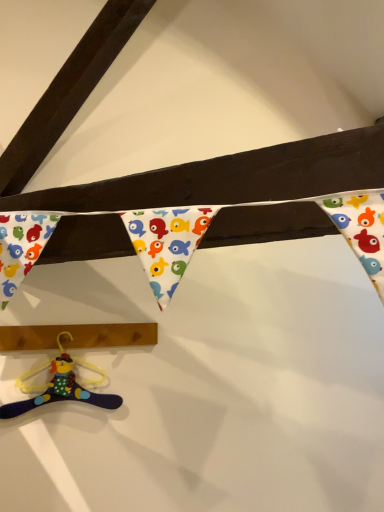
Locate an element on the screen. Image resolution: width=384 pixels, height=512 pixels. velvety purple hanger at lower left is located at coordinates (61, 384).

The width and height of the screenshot is (384, 512). What do you see at coordinates (61, 384) in the screenshot? I see `velvety purple hanger at lower left` at bounding box center [61, 384].

This screenshot has height=512, width=384. Describe the element at coordinates (77, 336) in the screenshot. I see `wooden plank at lower left` at that location.

At what (x,y) coordinates should I click in order to perform the action: click on wooden plank at lower left. Please return your answer as a coordinate pair (x, y). Looking at the image, I should click on (77, 336).

Find the location of a particular element. velvety purple hanger at lower left is located at coordinates (61, 384).

Which object is positioned more to the left, velvety purple hanger at lower left or wooden plank at lower left?

From the viewer's perspective, velvety purple hanger at lower left appears more on the left side.

In the image, is velvety purple hanger at lower left positioned in front of or behind wooden plank at lower left?

Clearly, velvety purple hanger at lower left is in front of wooden plank at lower left.

Which is behind, point (10, 407) or point (138, 327)?

The point (138, 327) is more distant.

From the image's perspective, is velvety purple hanger at lower left above or below wooden plank at lower left?

velvety purple hanger at lower left is situated lower than wooden plank at lower left in the image.

From a real-world perspective, does velvety purple hanger at lower left stand above wooden plank at lower left?

No, from a real-world perspective, velvety purple hanger at lower left is not on top of wooden plank at lower left.

Which of these two, velvety purple hanger at lower left or wooden plank at lower left, is wider?

wooden plank at lower left.

Considering the sizes of objects velvety purple hanger at lower left and wooden plank at lower left in the image provided, who is taller, velvety purple hanger at lower left or wooden plank at lower left?

Standing taller between the two is velvety purple hanger at lower left.

Considering the sizes of velvety purple hanger at lower left and wooden plank at lower left in the image, is velvety purple hanger at lower left bigger or smaller than wooden plank at lower left?

Considering their sizes, velvety purple hanger at lower left takes up less space than wooden plank at lower left.

Is velvety purple hanger at lower left positioned beyond the bounds of wooden plank at lower left?

Yes, velvety purple hanger at lower left is not within wooden plank at lower left.

Is velvety purple hanger at lower left in contact with wooden plank at lower left?

They are not placed beside each other.

Is velvety purple hanger at lower left turned away from wooden plank at lower left?

velvety purple hanger at lower left is not turned away from wooden plank at lower left.

From the picture: How different are the orientations of velvety purple hanger at lower left and wooden plank at lower left in degrees?

The facing directions of velvety purple hanger at lower left and wooden plank at lower left are 1.14 degrees apart.

Measure the distance from velvety purple hanger at lower left to wooden plank at lower left.

They are 4.59 inches apart.

Identify the location of plank on the right of velvety purple hanger at lower left. (77, 336).

Which is more to the left, wooden plank at lower left or velvety purple hanger at lower left?

velvety purple hanger at lower left.

Does wooden plank at lower left come behind velvety purple hanger at lower left?

Yes.

Considering the points (2, 335) and (62, 393), which point is in front, point (2, 335) or point (62, 393)?

Positioned in front is point (2, 335).

From the image's perspective, is wooden plank at lower left positioned above or below velvety purple hanger at lower left?

Clearly, from the image's perspective, wooden plank at lower left is above velvety purple hanger at lower left.

From a real-world perspective, who is located lower, wooden plank at lower left or velvety purple hanger at lower left?

velvety purple hanger at lower left, from a real-world perspective.

Is wooden plank at lower left thinner than velvety purple hanger at lower left?

In fact, wooden plank at lower left might be wider than velvety purple hanger at lower left.

Considering the relative sizes of wooden plank at lower left and velvety purple hanger at lower left in the image provided, is wooden plank at lower left shorter than velvety purple hanger at lower left?

Yes, wooden plank at lower left is shorter than velvety purple hanger at lower left.

Considering the sizes of objects wooden plank at lower left and velvety purple hanger at lower left in the image provided, who is smaller, wooden plank at lower left or velvety purple hanger at lower left?

Smaller between the two is velvety purple hanger at lower left.

Is wooden plank at lower left positioned beyond the bounds of velvety purple hanger at lower left?

Absolutely, wooden plank at lower left is external to velvety purple hanger at lower left.

Is there a large distance between wooden plank at lower left and velvety purple hanger at lower left?

No, there isn't a large distance between wooden plank at lower left and velvety purple hanger at lower left.

Is wooden plank at lower left facing away from velvety purple hanger at lower left?

No, velvety purple hanger at lower left is not at the back of wooden plank at lower left.

In the image, there is a velvety purple hanger at lower left. At what (x,y) coordinates should I click in order to perform the action: click on plank above it (from the image's perspective). Please return your answer as a coordinate pair (x, y). Looking at the image, I should click on (77, 336).

This screenshot has width=384, height=512. Find the location of `plank that appears above the velvety purple hanger at lower left (from a real-world perspective)`. plank that appears above the velvety purple hanger at lower left (from a real-world perspective) is located at coordinates (77, 336).

Identify the location of plank above the velvety purple hanger at lower left (from the image's perspective). The width and height of the screenshot is (384, 512). (77, 336).